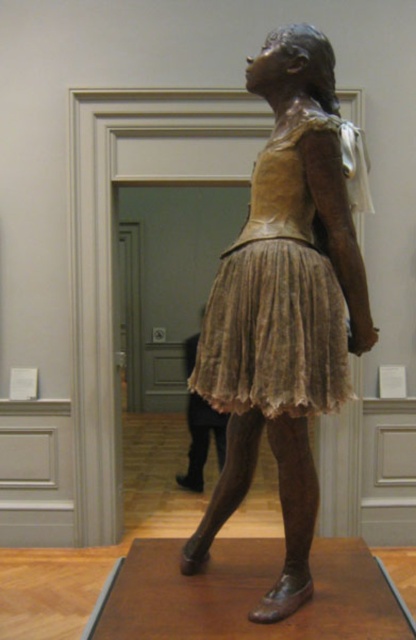
Looking at this image, does bronze textured sculpture at center appear on the left side of matte bronze dress at center?

Indeed, bronze textured sculpture at center is positioned on the left side of matte bronze dress at center.

Measure the distance from bronze textured sculpture at center to matte bronze dress at center.

2.36 inches

Who is more distant from viewer, (302, 188) or (344, 332)?

Positioned behind is point (302, 188).

The height and width of the screenshot is (640, 416). What are the coordinates of `bronze textured sculpture at center` in the screenshot? It's located at (284, 307).